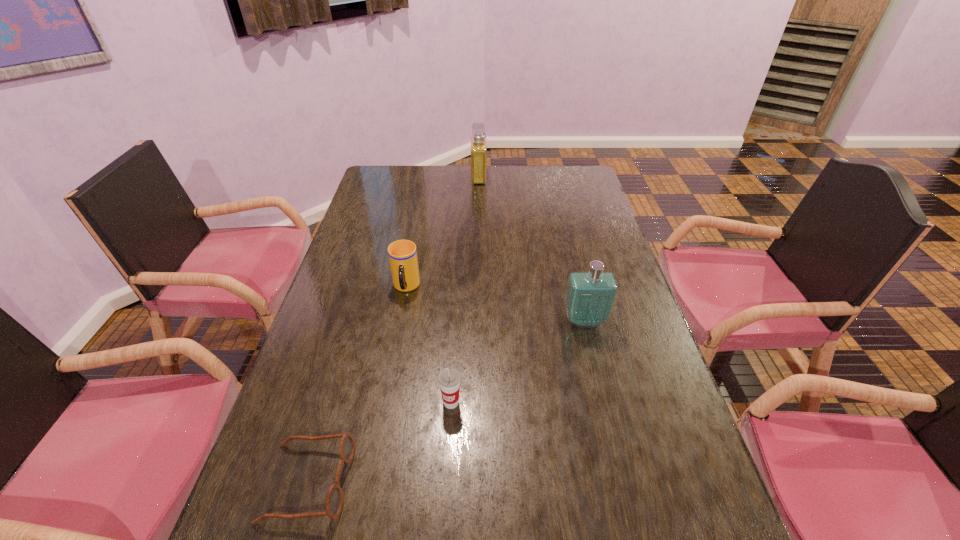
At what (x,y) coordinates should I click in order to perform the action: click on free location at the right edge. Please return your answer as a coordinate pair (x, y). This screenshot has height=540, width=960. Looking at the image, I should click on (629, 316).

Locate an element on the screen. This screenshot has height=540, width=960. free space at the far left corner of the desktop is located at coordinates click(x=378, y=181).

Find the location of a particular element. Image resolution: width=960 pixels, height=540 pixels. free space between the left perfume and the farther cup is located at coordinates (443, 232).

Find the location of a particular element. The image size is (960, 540). vacant space that is in between the nearest object and the fourth object from right to left is located at coordinates [357, 384].

Where is `free spot between the second nearest object and the second object from right to left`? Image resolution: width=960 pixels, height=540 pixels. free spot between the second nearest object and the second object from right to left is located at coordinates (465, 289).

This screenshot has height=540, width=960. What are the coordinates of `free spot between the leftmost object and the second object from left to right` in the screenshot? It's located at (357, 384).

Locate an element on the screen. This screenshot has width=960, height=540. empty space between the fourth farthest object and the farther cup is located at coordinates (428, 345).

Identify the location of vacant area that lies between the nearer cup and the fourth object from right to left. The image size is (960, 540). (428, 345).

Identify the location of free space that is in between the nearer cup and the third nearest object. The height and width of the screenshot is (540, 960). (518, 361).

Image resolution: width=960 pixels, height=540 pixels. Identify the location of vacant point located between the farthest object and the shortest object. (394, 329).